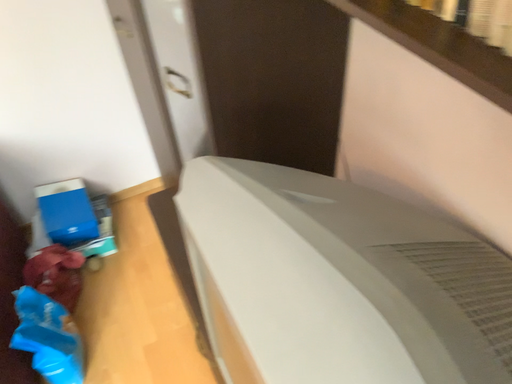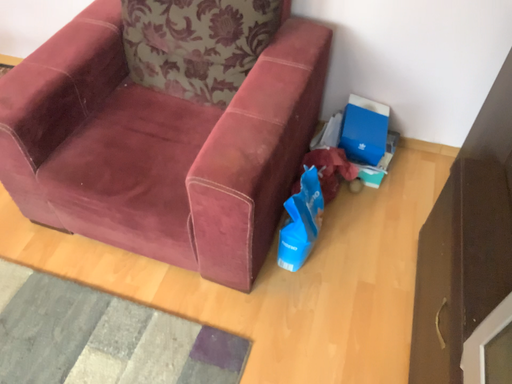
Question: Which way did the camera rotate in the video?

Choices:
 (A) rotated left
 (B) rotated right

Answer: (A)